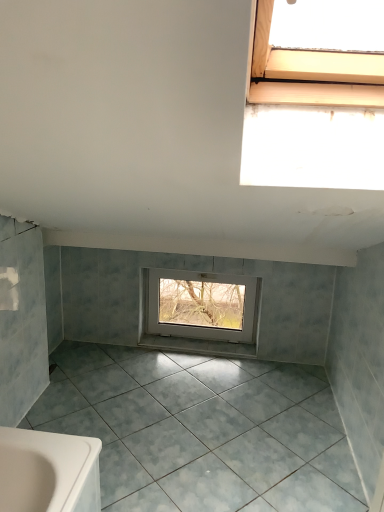
Question: Is white glossy tile at center not within white plastic window at center?

Choices:
 (A) no
 (B) yes

Answer: (B)

Question: From the image's perspective, would you say white glossy tile at center is shown under white plastic window at center?

Choices:
 (A) yes
 (B) no

Answer: (A)

Question: Can you confirm if white glossy tile at center is smaller than white plastic window at center?

Choices:
 (A) no
 (B) yes

Answer: (B)

Question: Is white plastic window at center completely or partially inside white glossy tile at center?

Choices:
 (A) no
 (B) yes

Answer: (A)

Question: Is white glossy tile at center to the left of white plastic window at center from the viewer's perspective?

Choices:
 (A) yes
 (B) no

Answer: (A)

Question: Is white glossy tile at center taller or shorter than gray matte tile at center?

Choices:
 (A) tall
 (B) short

Answer: (A)

Question: From the image's perspective, relative to gray matte tile at center, is white glossy tile at center above or below?

Choices:
 (A) below
 (B) above

Answer: (B)

Question: From a real-world perspective, is white glossy tile at center positioned above or below gray matte tile at center?

Choices:
 (A) below
 (B) above

Answer: (B)

Question: Looking at the image, does white glossy tile at center seem bigger or smaller compared to gray matte tile at center?

Choices:
 (A) small
 (B) big

Answer: (A)

Question: Based on their positions, is gray matte tile at center located to the left or right of white glossy tile at center?

Choices:
 (A) left
 (B) right

Answer: (A)

Question: Which is correct: gray matte tile at center is inside white glossy tile at center, or outside of it?

Choices:
 (A) inside
 (B) outside

Answer: (B)

Question: From the image's perspective, is gray matte tile at center above or below white glossy tile at center?

Choices:
 (A) below
 (B) above

Answer: (A)

Question: Is gray matte tile at center taller or shorter than white glossy tile at center?

Choices:
 (A) tall
 (B) short

Answer: (B)

Question: From the image's perspective, relative to white plastic window at center, is white glossy tile at center above or below?

Choices:
 (A) above
 (B) below

Answer: (B)

Question: Considering the positions of white glossy tile at center and white plastic window at center in the image, is white glossy tile at center wider or thinner than white plastic window at center?

Choices:
 (A) thin
 (B) wide

Answer: (B)